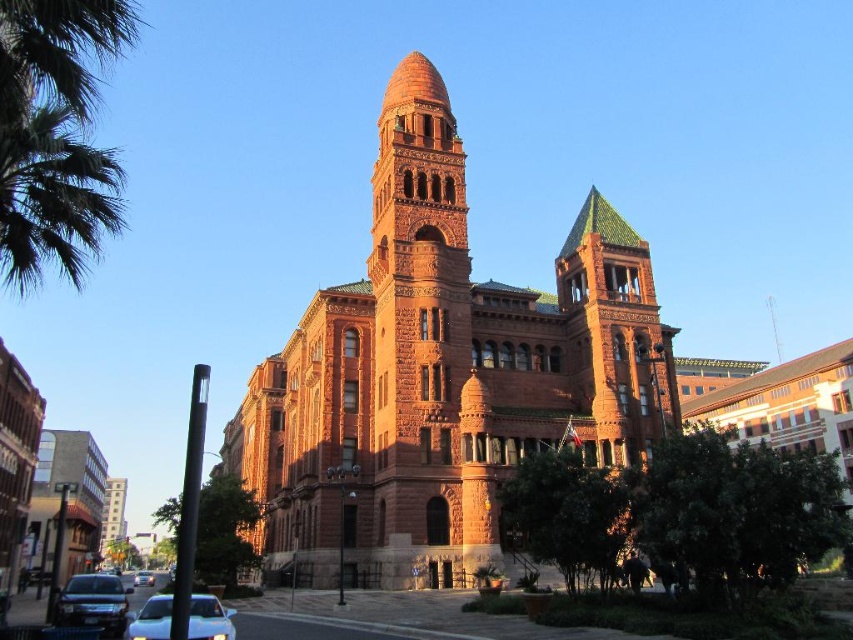
Which of these two, reddish-brown stone bell tower at center or shiny black sedan at lower left, stands shorter?

shiny black sedan at lower left

Can you confirm if reddish-brown stone bell tower at center is positioned to the left of shiny black sedan at lower left?

In fact, reddish-brown stone bell tower at center is to the right of shiny black sedan at lower left.

Does point (477, 396) come behind point (125, 625)?

Yes, it is behind point (125, 625).

Locate an element on the screen. The image size is (853, 640). reddish-brown stone bell tower at center is located at coordinates (418, 305).

Is green leafy palm tree at upper left taller than white glossy car at center?

Correct, green leafy palm tree at upper left is much taller as white glossy car at center.

Which is below, green leafy palm tree at upper left or white glossy car at center?

white glossy car at center

Identify the location of green leafy palm tree at upper left. The height and width of the screenshot is (640, 853). (55, 134).

Locate an element on the screen. green leafy palm tree at upper left is located at coordinates (55, 134).

Is shiny black sedan at lower left to the right of white glossy car at center from the viewer's perspective?

Correct, you'll find shiny black sedan at lower left to the right of white glossy car at center.

Between shiny black sedan at lower left and white glossy car at center, which one appears on the left side from the viewer's perspective?

Positioned to the left is white glossy car at center.

Image resolution: width=853 pixels, height=640 pixels. In order to click on shiny black sedan at lower left in this screenshot , I will do `click(93, 604)`.

Find the location of a particular element. shiny black sedan at lower left is located at coordinates (93, 604).